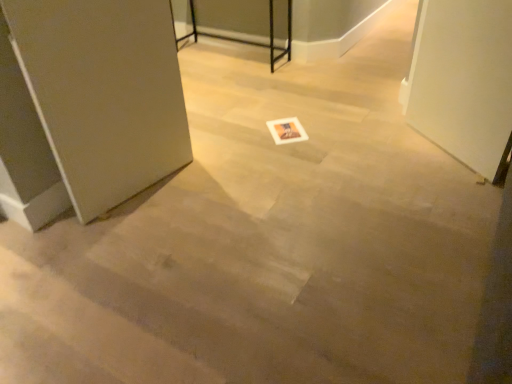
Locate an element on the screen. The image size is (512, 384). vacant space behind white paper postcard at center is located at coordinates click(x=283, y=113).